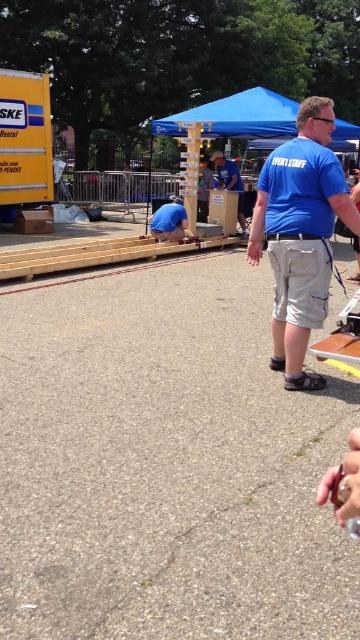
You are the event staff member standing in the foreground. You need to move to the wooden at center to check its stability. Which direction should you walk from your current position to reach it?

The wooden at center is located at point (x=96, y=259) in coordinates. Since you are in the foreground, you should walk forward towards the midground where the wooden structure is being constructed to reach it.

You are an event planner checking the setup. You notice the blue fabric at center and the matte blue shirt at center. Which object takes up more area in the image?

The matte blue shirt at center takes up more area than the blue fabric at center.